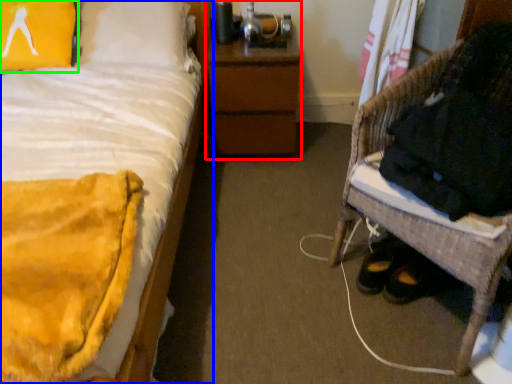
Question: Based on their relative distances, which object is farther from nightstand (highlighted by a red box)? Choose from bed (highlighted by a blue box) and pillow (highlighted by a green box).

Choices:
 (A) bed
 (B) pillow

Answer: (B)